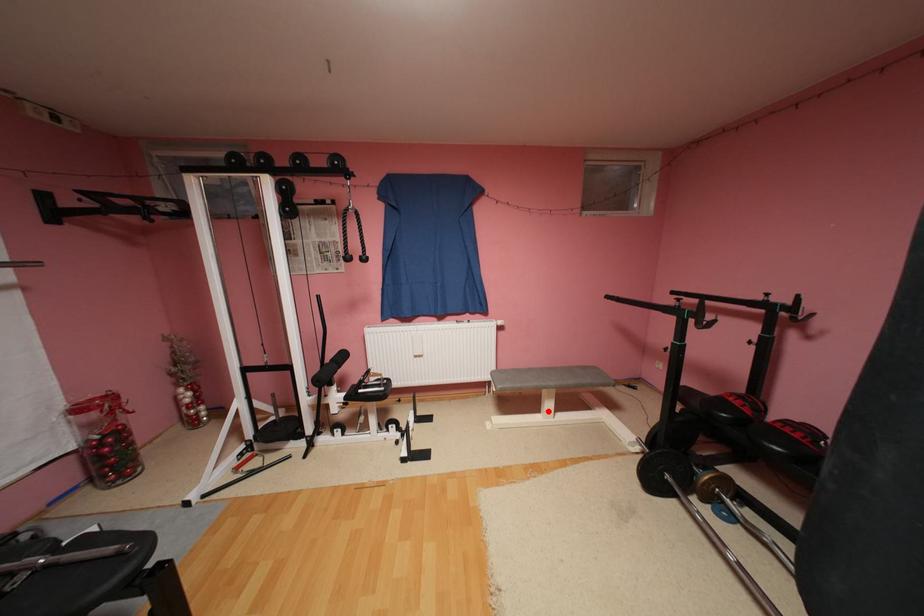
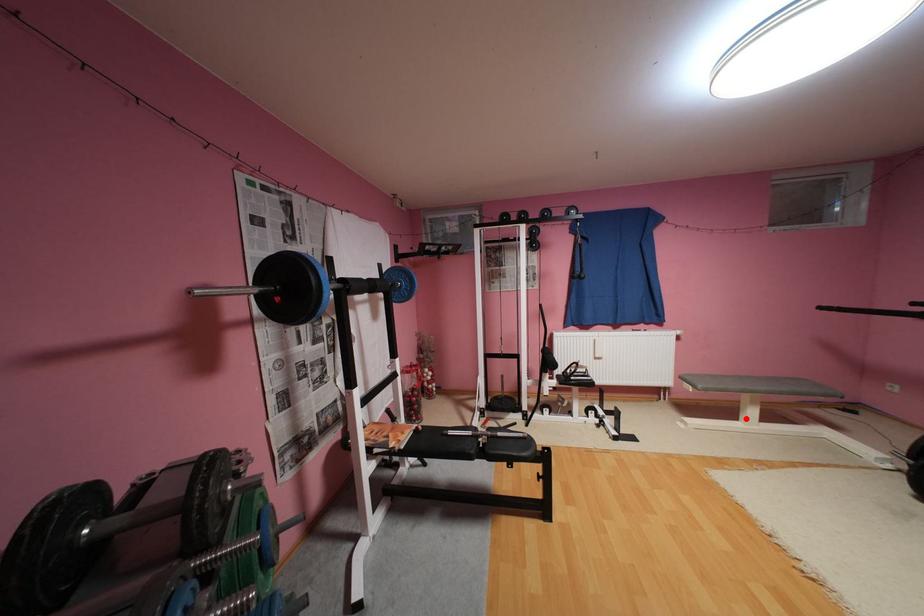
I am providing you with two images of the same scene from different viewpoints. A red point is marked on the first image and another point is marked on the second image. Do the highlighted points in image1 and image2 indicate the same real-world spot?

Yes